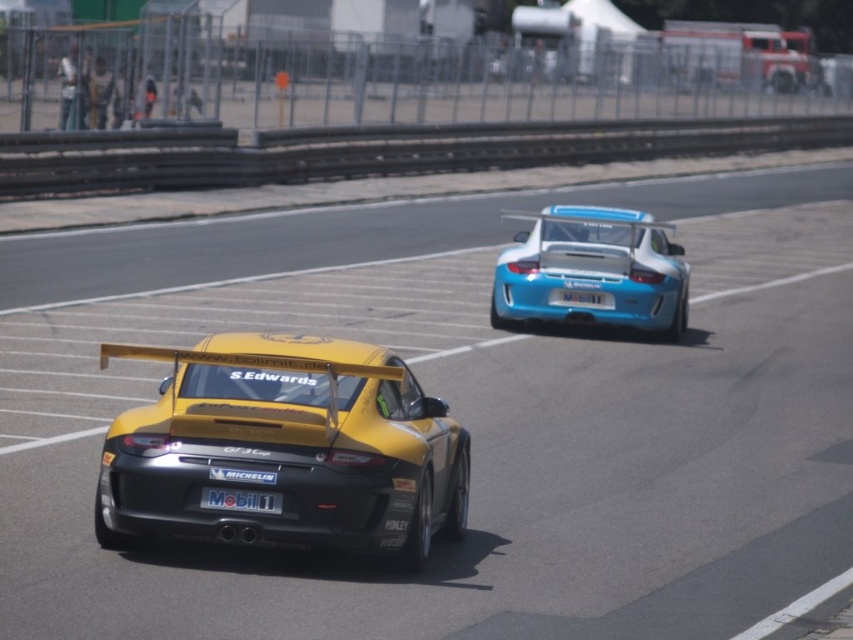
Consider the image. You are a photographer at the motorsport event. You need to capture a closeup shot of the license plates of both cars. Which license plate, the white glossy license plate at rear or the blue glossy license plate at rear, will require you to move closer to the car to get a clear photo?

The white glossy license plate at rear has a lesser width compared to the blue glossy license plate at rear. Therefore, to capture a clear closeup of the white glossy license plate at rear, you would need to move closer to the car since it is smaller in width.

You are a photographer at the motorsport event. You want to capture a photo where both the shiny blue car at upper right and the blue glossy license plate at rear are clearly visible. Considering their sizes, will the license plate be fully visible in the photo if the car is the main focus?

The shiny blue car at upper right is taller than the blue glossy license plate at rear. Since the car is the main focus and taller, the license plate will still be visible but might appear smaller in comparison. However, its entire surface should remain in frame as it is positioned behind the car.